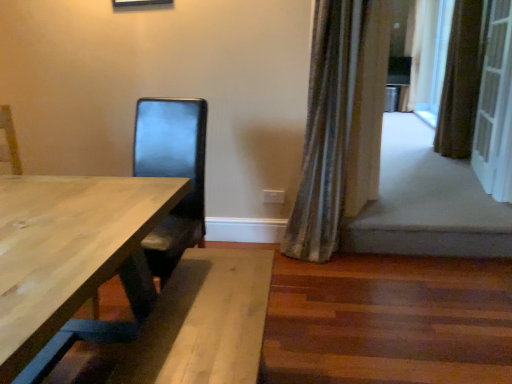
Question: Would you say silky green curtain at right, which ranks as the third curtain in back-to-front order, is to the left or to the right of brown textured curtain at right, marked as the second curtain in a left-to-right arrangement, in the picture?

Choices:
 (A) right
 (B) left

Answer: (B)

Question: Is silky green curtain at right, which is counted as the first curtain, starting from the left, taller or shorter than brown textured curtain at right, marked as the second curtain in a left-to-right arrangement?

Choices:
 (A) short
 (B) tall

Answer: (B)

Question: Which of these objects is positioned closest to the silky beige curtain at upper right, marked as the 3th curtain in a front-to-back arrangement?

Choices:
 (A) silky green curtain at right, the 1th curtain positioned from the front
 (B) white textured screen door at right
 (C) brown textured curtain at right, placed as the 2th curtain when sorted from right to left

Answer: (C)

Question: Estimate the real-world distances between objects in this image. Which object is closer to the silky green curtain at right, which is counted as the first curtain, starting from the left?

Choices:
 (A) brown textured curtain at right, the 2th curtain when ordered from back to front
 (B) white textured screen door at right
 (C) silky beige curtain at upper right, the first curtain positioned from the back

Answer: (B)